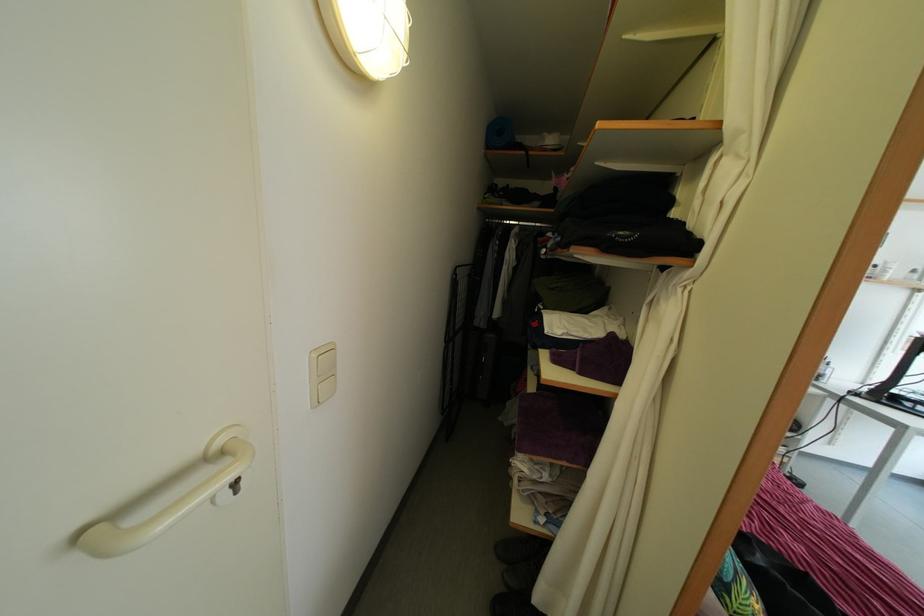
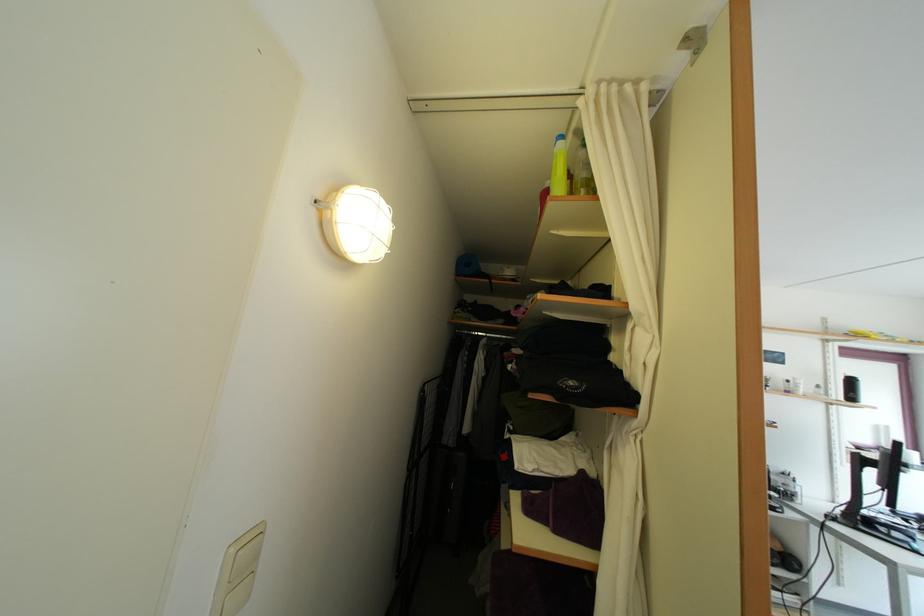
Question: The first image is from the beginning of the video and the second image is from the end. How did the camera likely rotate when shooting the video?

Choices:
 (A) Left
 (B) Right
 (C) Up
 (D) Down

Answer: (C)